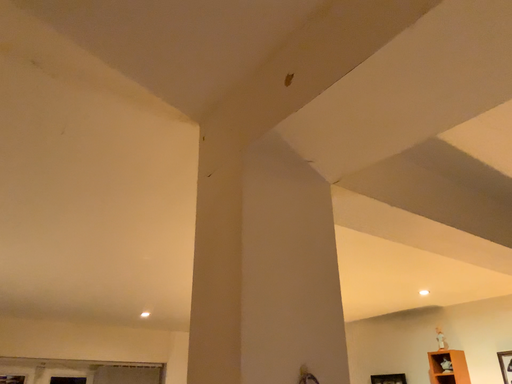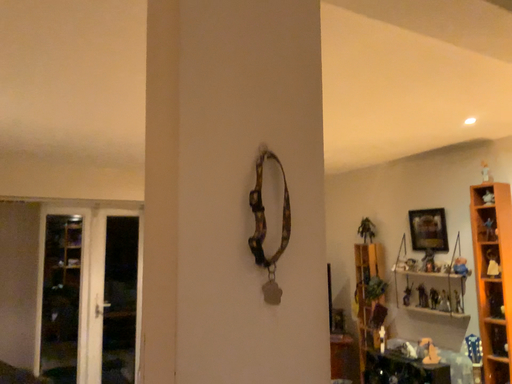
Question: Which way did the camera rotate in the video?

Choices:
 (A) rotated left
 (B) rotated right

Answer: (A)